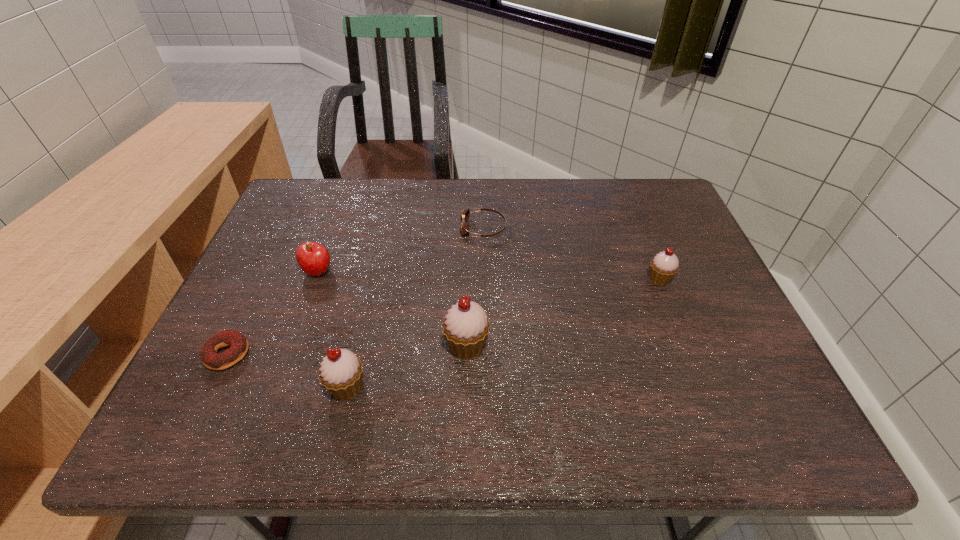
The image size is (960, 540). I want to click on doughnut located at the left edge, so click(238, 343).

Locate an element on the screen. object that is at the right edge is located at coordinates (664, 266).

This screenshot has height=540, width=960. Find the location of `object that is positioned at the near left corner`. object that is positioned at the near left corner is located at coordinates (238, 343).

This screenshot has width=960, height=540. In the image, there is a desktop. In order to click on free space at the far edge in this screenshot , I will do `click(602, 204)`.

Identify the location of vacant space at the near edge of the desktop. This screenshot has width=960, height=540. (413, 370).

The height and width of the screenshot is (540, 960). In order to click on vacant space at the left edge of the desktop in this screenshot , I will do `click(250, 313)`.

Image resolution: width=960 pixels, height=540 pixels. In the image, there is a desktop. In order to click on free space at the right edge in this screenshot , I will do `click(709, 266)`.

This screenshot has height=540, width=960. Find the location of `vacant area at the far left corner`. vacant area at the far left corner is located at coordinates (316, 191).

Locate an element on the screen. Image resolution: width=960 pixels, height=540 pixels. vacant space at the near left corner of the desktop is located at coordinates (272, 362).

Where is `blank space at the near right corner of the desktop`? blank space at the near right corner of the desktop is located at coordinates (771, 382).